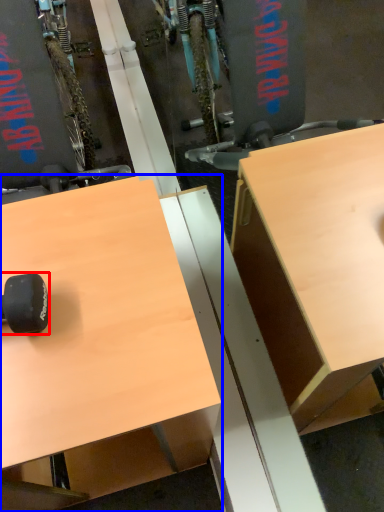
Question: Among these objects, which one is nearest to the camera, wheel (highlighted by a red box) or desk (highlighted by a blue box)?

Choices:
 (A) wheel
 (B) desk

Answer: (B)